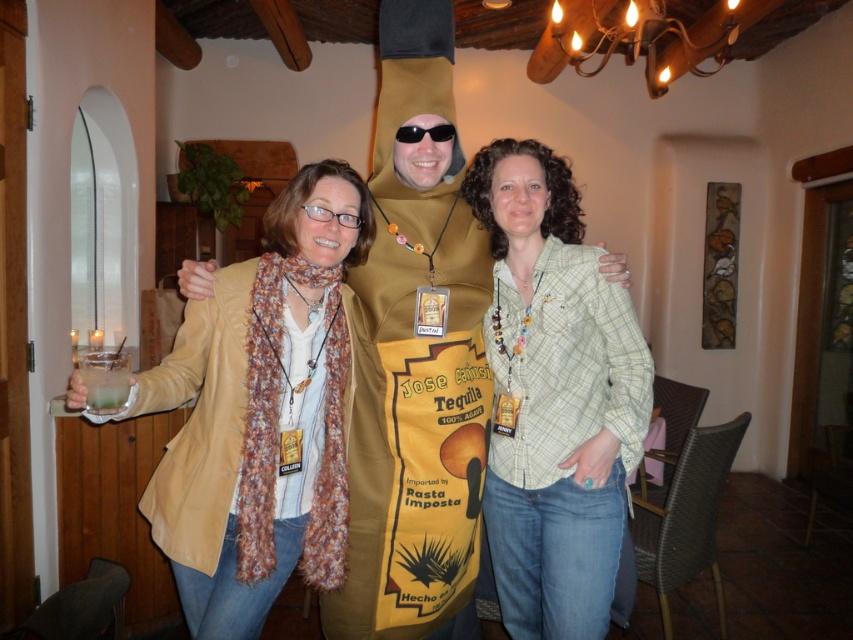
Between light green plaid shirt at center and gold paper bag at center, which one appears on the right side from the viewer's perspective?

light green plaid shirt at center is more to the right.

Locate an element on the screen. This screenshot has height=640, width=853. light green plaid shirt at center is located at coordinates (554, 397).

Where is `light green plaid shirt at center`? The image size is (853, 640). light green plaid shirt at center is located at coordinates (554, 397).

How far apart are light green plaid shirt at center and clear glass at left?

light green plaid shirt at center and clear glass at left are 38.64 inches apart from each other.

Can you confirm if light green plaid shirt at center is taller than clear glass at left?

Yes, light green plaid shirt at center is taller than clear glass at left.

Find the location of a particular element. light green plaid shirt at center is located at coordinates (554, 397).

Where is `light green plaid shirt at center`? This screenshot has height=640, width=853. light green plaid shirt at center is located at coordinates (554, 397).

Is gold paper bag at center further to the viewer compared to clear glass at left?

Yes.

What are the coordinates of `gold paper bag at center` in the screenshot? It's located at (405, 291).